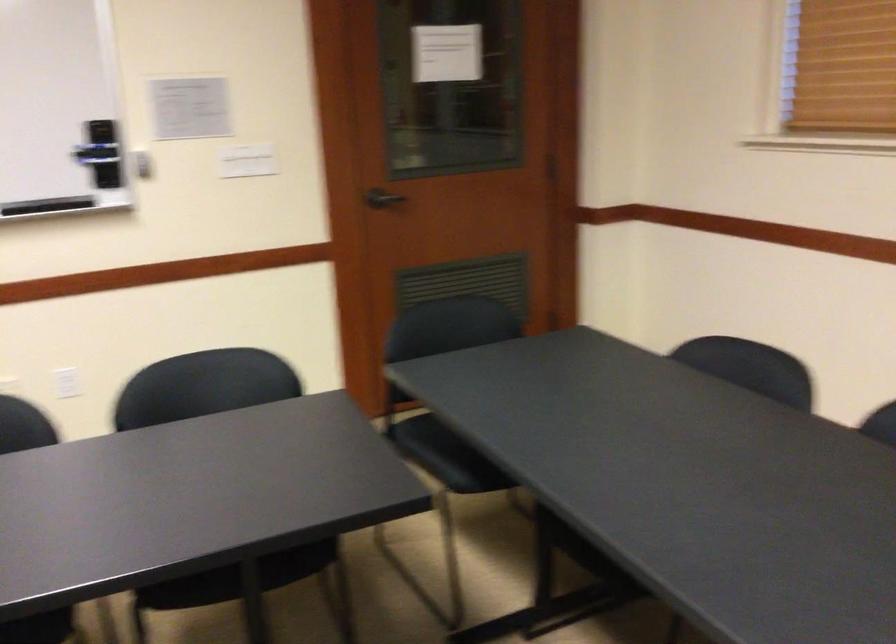
Find the location of a particular element. The image size is (896, 644). black door handle is located at coordinates pyautogui.click(x=382, y=200).